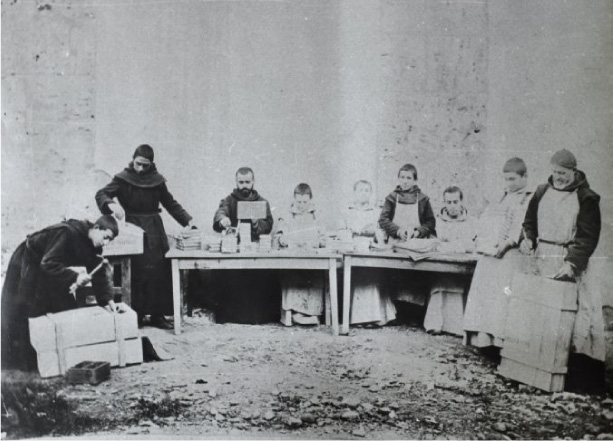
Where is `tables`? This screenshot has width=613, height=441. tables is located at coordinates (282, 259), (398, 264), (130, 248).